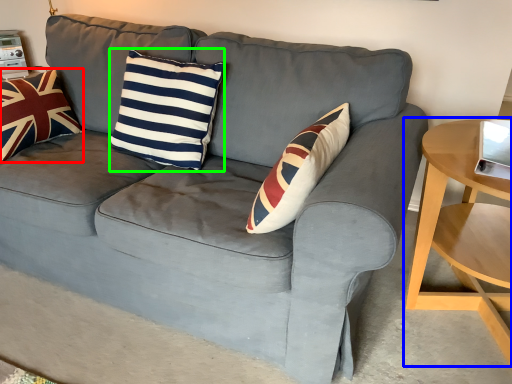
Question: Which object is the closest to the pillow (highlighted by a red box)? Choose among these: table (highlighted by a blue box) or pillow (highlighted by a green box).

Choices:
 (A) table
 (B) pillow

Answer: (B)